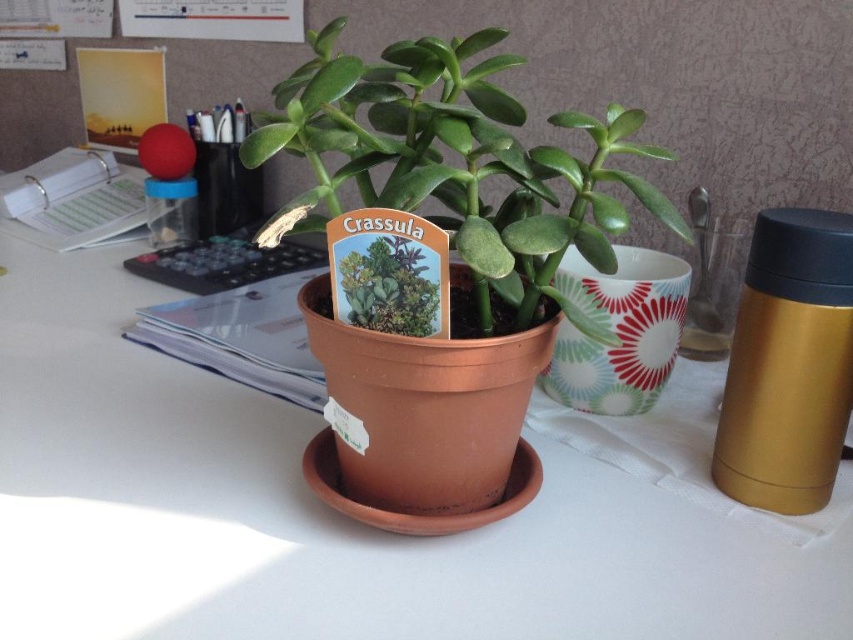
Question: Observing the image, what is the correct spatial positioning of matte brown pot at center in reference to matte clay pot at center?

Choices:
 (A) right
 (B) left

Answer: (B)

Question: Does matte brown pot at center appear on the right side of matte clay pot at center?

Choices:
 (A) yes
 (B) no

Answer: (B)

Question: Which point appears closest to the camera in this image?

Choices:
 (A) (294, 410)
 (B) (456, 49)

Answer: (B)

Question: Which point is farther to the camera?

Choices:
 (A) matte brown pot at center
 (B) matte clay pot at center

Answer: (A)

Question: Among these points, which one is farthest from the camera?

Choices:
 (A) (564, 628)
 (B) (518, 108)

Answer: (B)

Question: Does matte brown pot at center appear under matte clay pot at center?

Choices:
 (A) yes
 (B) no

Answer: (A)